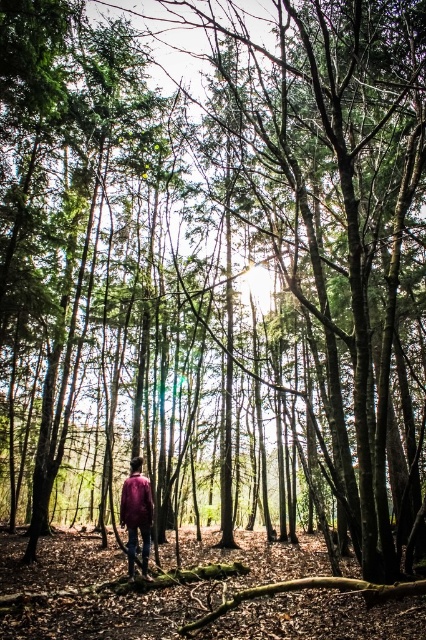
Question: Can you confirm if matte purple shirt at center is thinner than matte purple jacket at center?

Choices:
 (A) yes
 (B) no

Answer: (B)

Question: Can you confirm if matte purple shirt at center is positioned to the left of matte purple jacket at center?

Choices:
 (A) no
 (B) yes

Answer: (B)

Question: Does matte purple shirt at center have a lesser width compared to matte purple jacket at center?

Choices:
 (A) yes
 (B) no

Answer: (B)